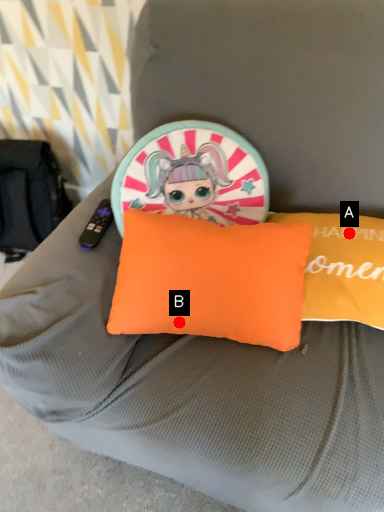
Question: Two points are circled on the image, labeled by A and B beside each circle. Which point is closer to the camera?

Choices:
 (A) A is closer
 (B) B is closer

Answer: (B)